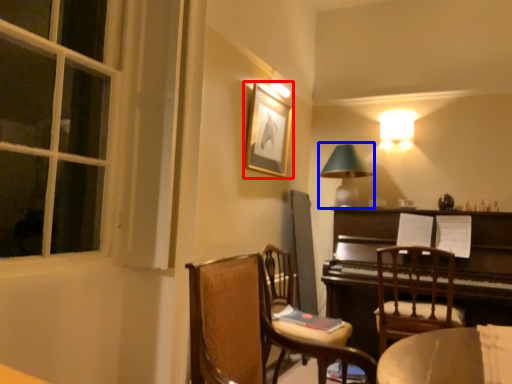
Question: Which point is further to the camera, picture frame (highlighted by a red box) or table lamp (highlighted by a blue box)?

Choices:
 (A) picture frame
 (B) table lamp

Answer: (B)